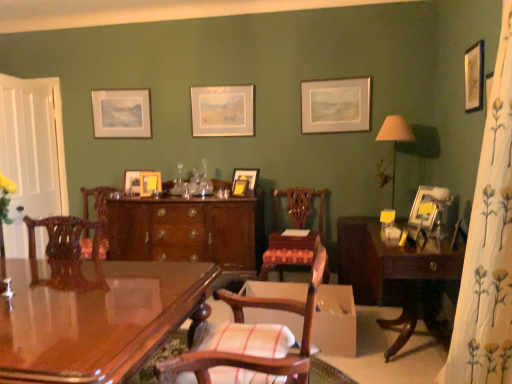
This screenshot has width=512, height=384. In order to click on matte silver picture frame at upper center, the 7th picture frame from the left in this screenshot , I will do tap(335, 105).

This screenshot has height=384, width=512. Describe the element at coordinates (247, 178) in the screenshot. I see `matte black picture frame at center, which is the sixth picture frame from back to front` at that location.

Identify the location of white floral fabric curtain at right. (488, 245).

The width and height of the screenshot is (512, 384). What do you see at coordinates (32, 154) in the screenshot?
I see `white wood screen door at left` at bounding box center [32, 154].

In order to click on matte wooden picture frame at upper left, marked as the ninth picture frame in a right-to-left arrangement in this screenshot , I will do `click(122, 113)`.

Where is `metallic gold picture frame at right, acting as the eighth picture frame starting from the back`? metallic gold picture frame at right, acting as the eighth picture frame starting from the back is located at coordinates (426, 203).

Where is `matte silver picture frame at upper center, which is the fifth picture frame in front-to-back order`? The width and height of the screenshot is (512, 384). matte silver picture frame at upper center, which is the fifth picture frame in front-to-back order is located at coordinates (335, 105).

Does point (467, 66) come closer to viewer compared to point (238, 177)?

Yes, it is.

At what (x,y) coordinates should I click in order to perform the action: click on picture frame that is the 5th object directly below the gold-framed picture at upper right, which ranks as the ninth picture frame in back-to-front order (from a real-world perspective). Please return your answer as a coordinate pair (x, y). Looking at the image, I should click on (247, 178).

How distant is gold-framed picture at upper right, which is the first picture frame from right to left, from matte black picture frame at center, which appears as the 4th picture frame when viewed from the right?

gold-framed picture at upper right, which is the first picture frame from right to left, is 1.77 meters from matte black picture frame at center, which appears as the 4th picture frame when viewed from the right.

Looking at this image, is gold-framed picture at upper right, which ranks as the ninth picture frame in back-to-front order, spatially inside matte black picture frame at center, which is the sixth picture frame from back to front, or outside of it?

gold-framed picture at upper right, which ranks as the ninth picture frame in back-to-front order, is located beyond the bounds of matte black picture frame at center, which is the sixth picture frame from back to front.

From a real-world perspective, who is located lower, white wood screen door at left or matte yellow picture frame at center, the third picture frame in the front-to-back sequence?

matte yellow picture frame at center, the third picture frame in the front-to-back sequence, is physically lower.

Is matte yellow picture frame at center, the third picture frame in the front-to-back sequence, surrounded by white wood screen door at left?

No, matte yellow picture frame at center, the third picture frame in the front-to-back sequence, is located outside of white wood screen door at left.

Which object is wider, white wood screen door at left or matte yellow picture frame at center, the 5th picture frame viewed from the right?

With larger width is white wood screen door at left.

From the image's perspective, is white wood screen door at left above or below matte yellow picture frame at center, the 5th picture frame viewed from the right?

Clearly, from the image's perspective, white wood screen door at left is above matte yellow picture frame at center, the 5th picture frame viewed from the right.

Considering the points (194, 227) and (291, 197), which point is behind, point (194, 227) or point (291, 197)?

The point (291, 197) is farther.

From the picture: How many degrees apart are the facing directions of mahogany cabinet at center and wooden chair at center, placed as the first chair when sorted from back to front?

The angular difference between mahogany cabinet at center and wooden chair at center, placed as the first chair when sorted from back to front, is 0.408 degrees.

From a real-world perspective, is mahogany cabinet at center positioned above or below wooden chair at center, placed as the first chair when sorted from back to front?

From a real-world perspective, mahogany cabinet at center is physically below wooden chair at center, placed as the first chair when sorted from back to front.

Looking at this image, considering their positions, is mahogany cabinet at center located in front of or behind wooden chair at center, which is the second chair from front to back?

Visually, mahogany cabinet at center is located behind wooden chair at center, which is the second chair from front to back.

From the image's perspective, is wooden table at right located beneath mahogany cabinet at center?

Indeed, from the image's perspective, wooden table at right is shown beneath mahogany cabinet at center.

Where is `cabinetry above the wooden table at right (from the image's perspective)`? The width and height of the screenshot is (512, 384). cabinetry above the wooden table at right (from the image's perspective) is located at coordinates (184, 231).

Is wooden table at right facing away from mahogany cabinet at center?

wooden table at right does not have its back to mahogany cabinet at center.

Can you confirm if wooden table at right is wider than mahogany cabinet at center?

Yes.

Considering the relative sizes of wooden chair with striped cushion at center, which appears as the second chair when viewed from the back, and matte yellow picture frame at center, which ranks as the 4th picture frame in back-to-front order, in the image provided, is wooden chair with striped cushion at center, which appears as the second chair when viewed from the back, shorter than matte yellow picture frame at center, which ranks as the 4th picture frame in back-to-front order,?

No.

From a real-world perspective, count 1st chairs downward from the matte yellow picture frame at center, which ranks as the 4th picture frame in back-to-front order, and point to it. Please provide its 2D coordinates.

[(249, 343)]

From the image's perspective, who appears lower, wooden chair with striped cushion at center, which appears as the second chair when viewed from the back, or matte yellow picture frame at center, which appears as the 3th picture frame when viewed from the left?

wooden chair with striped cushion at center, which appears as the second chair when viewed from the back.

Is point (193, 361) behind point (143, 183)?

No, (193, 361) is in front of (143, 183).

From the image's perspective, is wooden chair with striped cushion at center, which appears as the second chair when viewed from the back, on matte yellow picture frame at center, the third picture frame in the front-to-back sequence?

No, from the image's perspective, wooden chair with striped cushion at center, which appears as the second chair when viewed from the back, is not over matte yellow picture frame at center, the third picture frame in the front-to-back sequence.

Is wooden chair with striped cushion at center, which appears as the second chair when viewed from the back, at the left side of matte yellow picture frame at center, the 5th picture frame viewed from the right?

Incorrect, wooden chair with striped cushion at center, which appears as the second chair when viewed from the back, is not on the left side of matte yellow picture frame at center, the 5th picture frame viewed from the right.

From a real-world perspective, which is physically below, wooden chair with striped cushion at center, which appears as the second chair when viewed from the back, or matte yellow picture frame at center, the fifth picture frame when ordered from left to right?

In real-world perspective, wooden chair with striped cushion at center, which appears as the second chair when viewed from the back, is lower.

Does white floral fabric curtain at right have a lesser width compared to matte wooden picture frame at center, which appears as the fourth picture frame when viewed from the left?

No.

Is white floral fabric curtain at right surrounding matte wooden picture frame at center, the third picture frame when ordered from back to front?

Definitely not — matte wooden picture frame at center, the third picture frame when ordered from back to front, is not inside white floral fabric curtain at right.

Is white floral fabric curtain at right shorter than matte wooden picture frame at center, which appears as the seventh picture frame when viewed from the front?

Incorrect, the height of white floral fabric curtain at right does not fall short of that of matte wooden picture frame at center, which appears as the seventh picture frame when viewed from the front.

From the image's perspective, is white floral fabric curtain at right beneath matte wooden picture frame at center, which appears as the fourth picture frame when viewed from the left?

Yes, from the image's perspective, white floral fabric curtain at right is beneath matte wooden picture frame at center, which appears as the fourth picture frame when viewed from the left.

This screenshot has height=384, width=512. I want to click on picture frame that is the 1st one when counting upward from the matte black picture frame at center, the fourth picture frame from the front (from the image's perspective), so pos(474,77).

Where is `screen door that appears above the matte yellow picture frame at center, the fifth picture frame when ordered from left to right (from a real-world perspective)`? The width and height of the screenshot is (512, 384). screen door that appears above the matte yellow picture frame at center, the fifth picture frame when ordered from left to right (from a real-world perspective) is located at coordinates (32, 154).

Considering their positions, is matte yellow picture frame at center, the fifth picture frame when ordered from left to right, positioned further to matte yellow picture frame at center, acting as the sixth picture frame starting from the front, than white floral fabric curtain at right?

white floral fabric curtain at right.

When comparing their distances from matte silver picture frame at upper center, the 7th picture frame from the left, does wooden chair with striped cushion at center, which appears as the second chair when viewed from the back, or white floral fabric curtain at right seem closer?

white floral fabric curtain at right.

Looking at the image, which one is located closer to matte yellow picture frame at center, acting as the sixth picture frame starting from the front, wooden table at right or wooden chair at center, placed as the first chair when sorted from back to front?

The object closer to matte yellow picture frame at center, acting as the sixth picture frame starting from the front, is wooden chair at center, placed as the first chair when sorted from back to front.

When comparing their distances from metallic gold picture frame at right, acting as the eighth picture frame starting from the back, does matte wooden picture frame at center, which appears as the fourth picture frame when viewed from the left, or matte black picture frame at center, which appears as the 4th picture frame when viewed from the right, seem further?

matte wooden picture frame at center, which appears as the fourth picture frame when viewed from the left, lies further to metallic gold picture frame at right, acting as the eighth picture frame starting from the back, than the other object.

Which object lies further to the anchor point matte yellow picture frame at center, marked as the seventh picture frame in a back-to-front arrangement, wooden chair at center, which is the second chair from front to back, or matte silver picture frame at upper center, the 7th picture frame from the left?

Among the two, matte silver picture frame at upper center, the 7th picture frame from the left, is located further to matte yellow picture frame at center, marked as the seventh picture frame in a back-to-front arrangement.

Considering their positions, is metallic gold picture frame at right, arranged as the 2th picture frame when viewed from the right, positioned closer to matte yellow picture frame at center, acting as the sixth picture frame starting from the front, than matte black picture frame at center, which appears as the 4th picture frame when viewed from the right?

matte black picture frame at center, which appears as the 4th picture frame when viewed from the right, lies closer to matte yellow picture frame at center, acting as the sixth picture frame starting from the front, than the other object.

When comparing their distances from mahogany cabinet at center, does white wood screen door at left or wooden picture frame at center, which is the eighth picture frame from right to left, seem closer?

wooden picture frame at center, which is the eighth picture frame from right to left.

When comparing their distances from matte yellow picture frame at center, which ranks as the 4th picture frame in back-to-front order, does glossy wood desk at center or wooden chair with striped cushion at center, which appears as the second chair when viewed from the back, seem closer?

glossy wood desk at center is closer to matte yellow picture frame at center, which ranks as the 4th picture frame in back-to-front order.

Find the location of a particular element. Image resolution: width=512 pixels, height=384 pixels. curtain situated between glossy wood desk at center and metallic gold picture frame at right, arranged as the 2th picture frame when viewed from the right, from left to right is located at coordinates tap(488, 245).

You are a GUI agent. You are given a task and a screenshot of the screen. Output one action in this format:
    pyautogui.click(x=<x>, y=<y>)
    Task: Click on the table lamp located between gold-framed picture at upper right, the ninth picture frame viewed from the left, and matte silver picture frame at upper center, acting as the third picture frame starting from the right, in the depth direction
    This screenshot has height=384, width=512.
    Given the screenshot: What is the action you would take?
    pyautogui.click(x=395, y=140)

At what (x,y) coordinates should I click in order to perform the action: click on cabinetry between wooden chair with striped cushion at center, the first chair when ordered from front to back, and matte yellow picture frame at center, which appears as the 3th picture frame when viewed from the left, along the z-axis. Please return your answer as a coordinate pair (x, y). Image resolution: width=512 pixels, height=384 pixels. Looking at the image, I should click on (184, 231).

The width and height of the screenshot is (512, 384). Identify the location of curtain between glossy wood desk at center and matte wooden picture frame at upper left, which is counted as the first picture frame, starting from the back, along the z-axis. (488, 245).